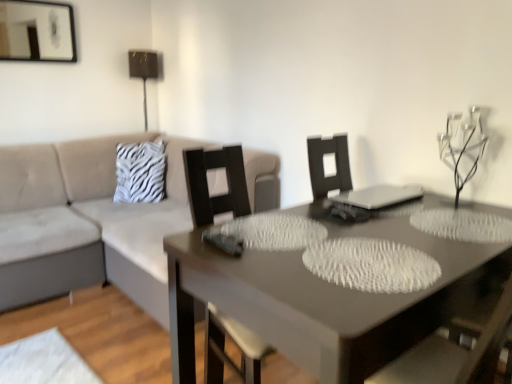
The image size is (512, 384). I want to click on free space on the front side of clear glass candle holder at upper right, so click(477, 220).